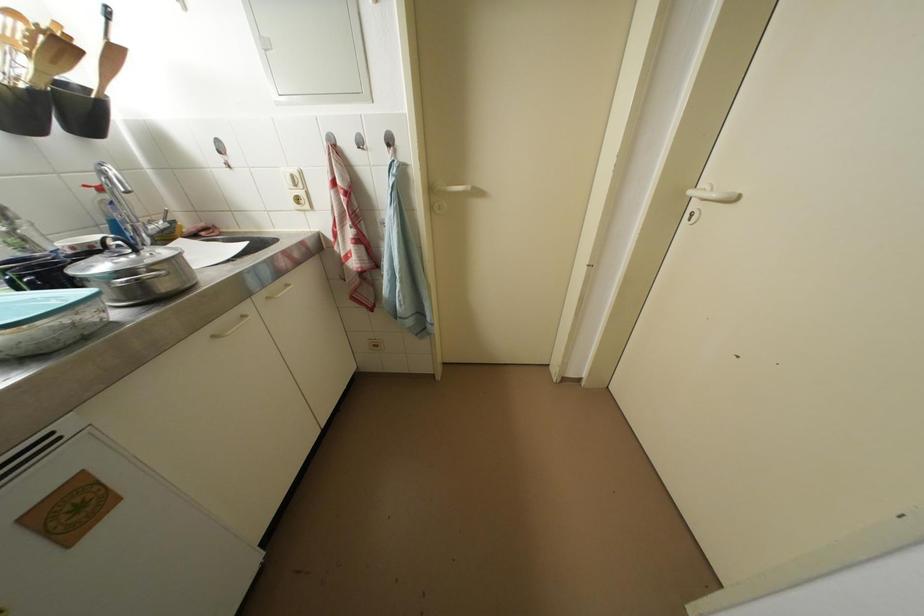
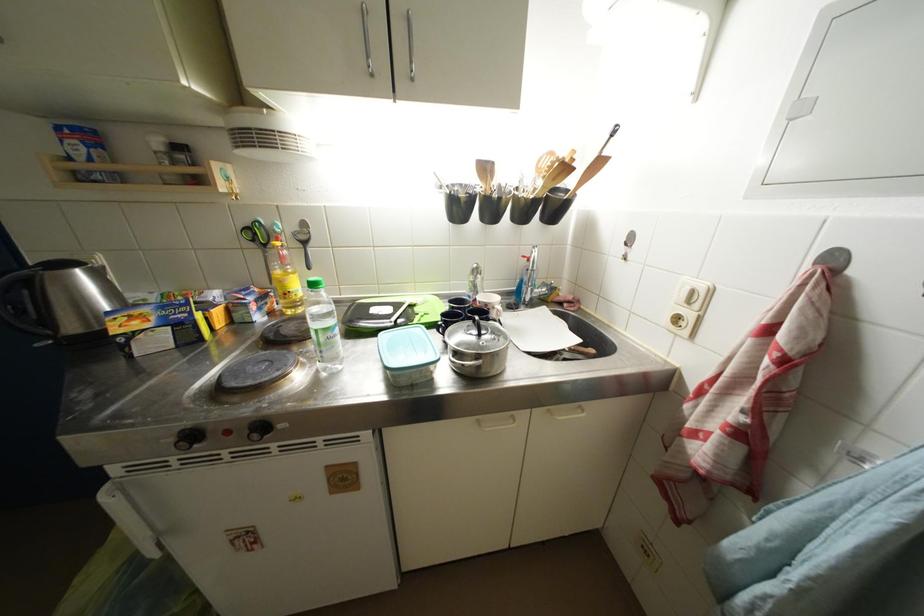
The point at (46, 34) is marked in the first image. Where is the corresponding point in the second image?

(565, 164)